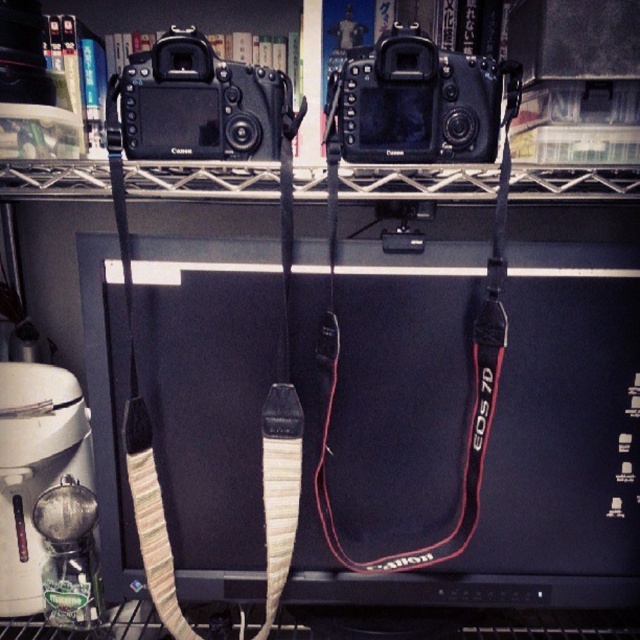
You are a photographer setting up a display for a camera exhibition. You need to arrange the black matte camera at center and the black matte camera at upper center on a shelf. Based on their sizes, which camera should be placed in the front to ensure both are visible?

The black matte camera at center is larger than the black matte camera at upper center, so placing the smaller black matte camera at upper center in the front would allow both cameras to be visible without one blocking the other.